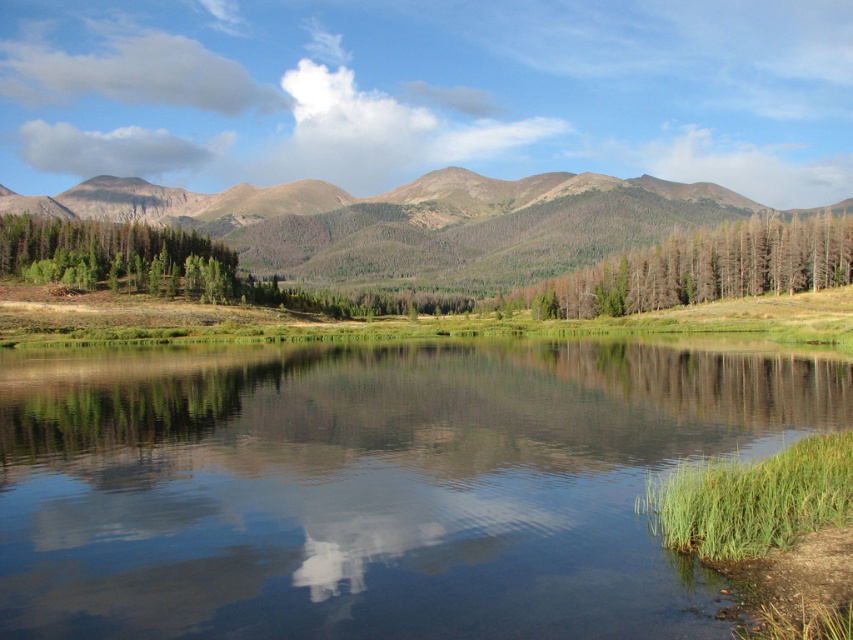
You are planning to take a photo of the green forested mountain at center and the dead wood trees at center from a drone. Which object will appear larger in the photo?

The green forested mountain at center will appear larger in the photo because it is much taller than the dead wood trees at center.